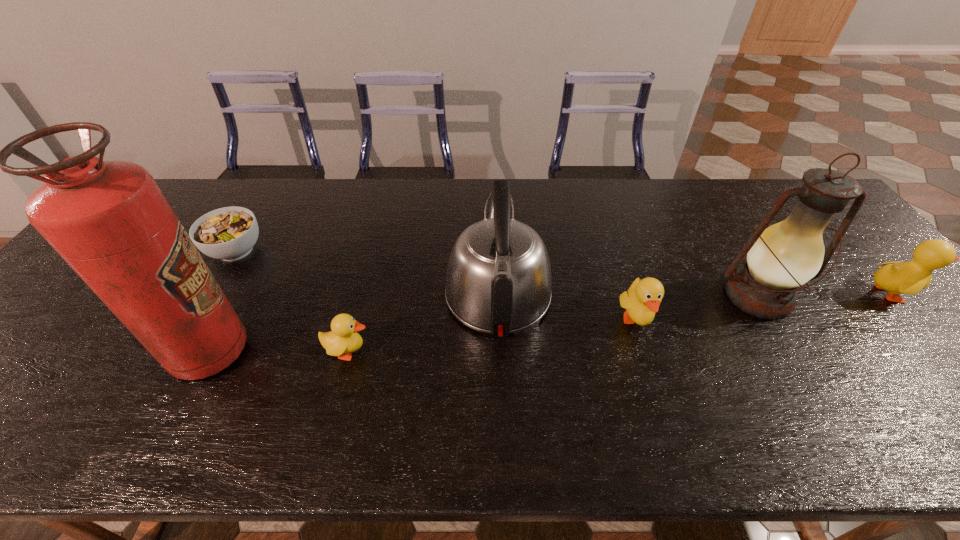
All ducklings are currently evenly spaced. To continue this pattern, where would you add another duckling on the left? Please point out a vacant spot. Please provide its 2D coordinates. Your answer should be formatted as a tuple, i.e. [(x, y)], where the tuple contains the x and y coordinates of a point satisfying the conditions above.

[(24, 387)]